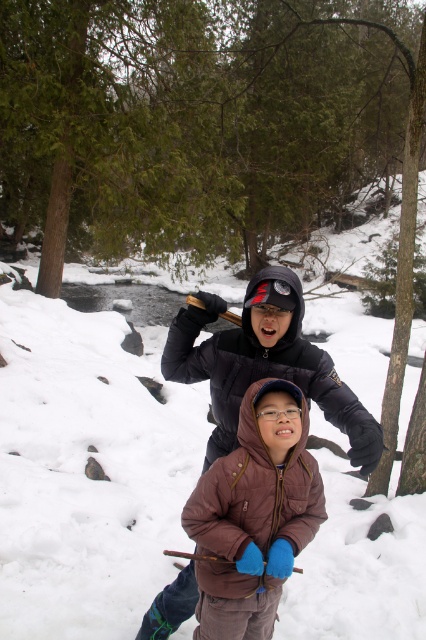
Question: Does white fluffy snow at center have a greater width compared to brown leather jacket at center?

Choices:
 (A) yes
 (B) no

Answer: (A)

Question: Which object is farther from the camera taking this photo?

Choices:
 (A) brown matte jacket at center
 (B) white fluffy snow at center

Answer: (B)

Question: Which point appears closest to the camera in this image?

Choices:
 (A) (241, 525)
 (B) (206, 304)
 (C) (14, 628)

Answer: (A)

Question: Can you confirm if brown leather jacket at center is positioned above brown matte jacket at center?

Choices:
 (A) no
 (B) yes

Answer: (A)

Question: Observing the image, what is the correct spatial positioning of white fluffy snow at center in reference to brown leather jacket at center?

Choices:
 (A) left
 (B) right

Answer: (B)

Question: Which point is farther to the camera?

Choices:
 (A) white fluffy snow at center
 (B) brown matte jacket at center

Answer: (A)